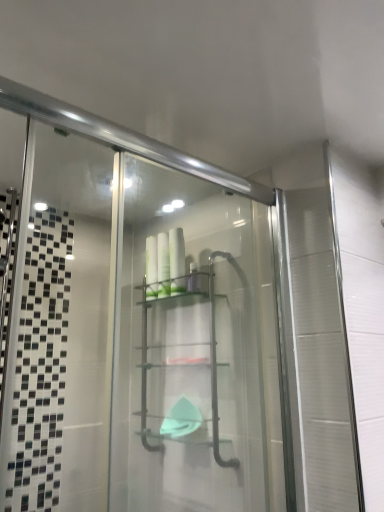
I want to click on white glossy bottles at center, the 2th toiletry viewed from the left, so click(163, 265).

Where is `white glossy bottles at center, the 2th toiletry from the right`? The width and height of the screenshot is (384, 512). white glossy bottles at center, the 2th toiletry from the right is located at coordinates (151, 267).

Is white glossy bottles at center, the 1th toiletry in the right-to-left sequence, next to white glossy bottles at center, which is the first toiletry from left to right?

Yes, white glossy bottles at center, the 1th toiletry in the right-to-left sequence, is beside white glossy bottles at center, which is the first toiletry from left to right.

Between white glossy bottles at center, the 2th toiletry viewed from the left, and white glossy bottles at center, the 2th toiletry from the right, which one is positioned in front?

white glossy bottles at center, the 2th toiletry viewed from the left, is closer to the camera.

Can you tell me how much white glossy bottles at center, the 2th toiletry viewed from the left, and white glossy bottles at center, which is the first toiletry from left to right, differ in facing direction?

8.59e-05 degrees separate the facing orientations of white glossy bottles at center, the 2th toiletry viewed from the left, and white glossy bottles at center, which is the first toiletry from left to right.

Would you say white glossy bottles at center, the 1th toiletry in the right-to-left sequence, is outside white glossy bottles at center, the 2th toiletry from the right?

Indeed, white glossy bottles at center, the 1th toiletry in the right-to-left sequence, is completely outside white glossy bottles at center, the 2th toiletry from the right.

Is clear plastic shelf at center inside or outside of white glossy bottles at center, the 2th toiletry viewed from the left?

A: clear plastic shelf at center is not enclosed by white glossy bottles at center, the 2th toiletry viewed from the left.

From the picture: Is clear plastic shelf at center shorter than white glossy bottles at center, the 2th toiletry viewed from the left?

Incorrect, the height of clear plastic shelf at center does not fall short of that of white glossy bottles at center, the 2th toiletry viewed from the left.

Is clear plastic shelf at center further to the viewer compared to white glossy bottles at center, the 1th toiletry in the right-to-left sequence?

No, the depth of clear plastic shelf at center is less than that of white glossy bottles at center, the 1th toiletry in the right-to-left sequence.

From the image's perspective, between clear plastic shelf at center and white glossy bottles at center, the 2th toiletry viewed from the left, which one is located above?

white glossy bottles at center, the 2th toiletry viewed from the left.

Does point (141, 288) come closer to viewer compared to point (149, 239)?

That is True.

Which of these two, clear plastic shelf at center or white glossy bottles at center, which is the first toiletry from left to right, is thinner?

white glossy bottles at center, which is the first toiletry from left to right, is thinner.

How different are the orientations of clear plastic shelf at center and white glossy bottles at center, the 2th toiletry from the right, in degrees?

clear plastic shelf at center and white glossy bottles at center, the 2th toiletry from the right, are facing 3.12 degrees away from each other.

Is clear plastic shelf at center oriented towards white glossy bottles at center, the 2th toiletry from the right?

Yes, clear plastic shelf at center is facing white glossy bottles at center, the 2th toiletry from the right.

Is white glossy bottles at center, the 1th toiletry in the right-to-left sequence, shorter than clear plastic shelf at center?

Indeed, white glossy bottles at center, the 1th toiletry in the right-to-left sequence, has a lesser height compared to clear plastic shelf at center.

In order to click on glass box that appears below the white glossy bottles at center, the 1th toiletry in the right-to-left sequence (from a real-world perspective) in this screenshot , I will do `click(184, 364)`.

Would you say white glossy bottles at center, the 2th toiletry viewed from the left, is inside or outside clear plastic shelf at center?

white glossy bottles at center, the 2th toiletry viewed from the left, can be found inside clear plastic shelf at center.

Considering the sizes of objects white glossy bottles at center, the 2th toiletry from the right, and white glossy bottles at center, the 2th toiletry viewed from the left, in the image provided, who is taller, white glossy bottles at center, the 2th toiletry from the right, or white glossy bottles at center, the 2th toiletry viewed from the left,?

Standing taller between the two is white glossy bottles at center, the 2th toiletry viewed from the left.

Measure the distance between white glossy bottles at center, which is the first toiletry from left to right, and white glossy bottles at center, the 1th toiletry in the right-to-left sequence.

white glossy bottles at center, which is the first toiletry from left to right, is 4.67 centimeters away from white glossy bottles at center, the 1th toiletry in the right-to-left sequence.

Is white glossy bottles at center, the 2th toiletry from the right, beside white glossy bottles at center, the 1th toiletry in the right-to-left sequence?

Yes, white glossy bottles at center, the 2th toiletry from the right, is with white glossy bottles at center, the 1th toiletry in the right-to-left sequence.

How different are the orientations of white glossy bottles at center, which is the first toiletry from left to right, and white glossy bottles at center, the 1th toiletry in the right-to-left sequence, in degrees?

8.59e-05 degrees.

Are white glossy bottles at center, the 2th toiletry from the right, and clear plastic shelf at center located far from each other?

That's not correct — white glossy bottles at center, the 2th toiletry from the right, is a little close to clear plastic shelf at center.

Which object is thinner, white glossy bottles at center, which is the first toiletry from left to right, or clear plastic shelf at center?

With smaller width is white glossy bottles at center, which is the first toiletry from left to right.

Considering the sizes of white glossy bottles at center, the 2th toiletry from the right, and clear plastic shelf at center in the image, is white glossy bottles at center, the 2th toiletry from the right, taller or shorter than clear plastic shelf at center?

Considering their sizes, white glossy bottles at center, the 2th toiletry from the right, has less height than clear plastic shelf at center.

Is white glossy bottles at center, which is the first toiletry from left to right, spatially inside clear plastic shelf at center, or outside of it?

white glossy bottles at center, which is the first toiletry from left to right, is enclosed within clear plastic shelf at center.

Identify the location of toiletry above the white glossy bottles at center, the 2th toiletry from the right (from the image's perspective). (163, 265).

There is a clear plastic shelf at center. Identify the location of the 2nd toiletry above it (from a real-world perspective). (163, 265).

Which object lies nearer to the anchor point white glossy bottles at center, the 2th toiletry viewed from the left, clear plastic shelf at center or white glossy bottles at center, which is the first toiletry from left to right?

white glossy bottles at center, which is the first toiletry from left to right, is positioned closer to the anchor white glossy bottles at center, the 2th toiletry viewed from the left.

Looking at the image, which one is located closer to clear plastic shelf at center, white glossy bottles at center, the 2th toiletry viewed from the left, or white glossy bottles at center, the 2th toiletry from the right?

white glossy bottles at center, the 2th toiletry viewed from the left, lies closer to clear plastic shelf at center than the other object.

Looking at the image, which one is located further to white glossy bottles at center, which is the first toiletry from left to right, clear plastic shelf at center or white glossy bottles at center, the 2th toiletry viewed from the left?

clear plastic shelf at center is further to white glossy bottles at center, which is the first toiletry from left to right.

From the picture: Considering their positions, is white glossy bottles at center, the 1th toiletry in the right-to-left sequence, positioned further to white glossy bottles at center, the 2th toiletry from the right, than clear plastic shelf at center?

clear plastic shelf at center is positioned further to the anchor white glossy bottles at center, the 2th toiletry from the right.

From the picture: When comparing their distances from white glossy bottles at center, the 1th toiletry in the right-to-left sequence, does white glossy bottles at center, the 2th toiletry from the right, or clear plastic shelf at center seem further?

clear plastic shelf at center.

Looking at the image, which one is located closer to clear plastic shelf at center, white glossy bottles at center, which is the first toiletry from left to right, or white glossy bottles at center, the 1th toiletry in the right-to-left sequence?

white glossy bottles at center, the 1th toiletry in the right-to-left sequence, is closer to clear plastic shelf at center.

Where is `toiletry that lies between white glossy bottles at center, the 2th toiletry viewed from the left, and clear plastic shelf at center from top to bottom`? The image size is (384, 512). toiletry that lies between white glossy bottles at center, the 2th toiletry viewed from the left, and clear plastic shelf at center from top to bottom is located at coordinates (151, 267).